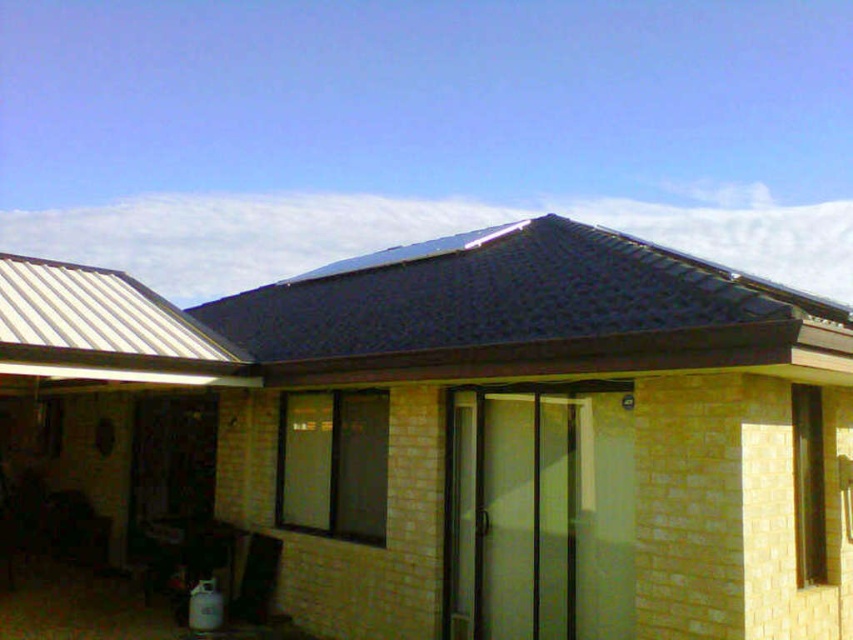
Question: Which of the following is the farthest from the observer?

Choices:
 (A) (677, 337)
 (B) (546, 314)

Answer: (B)

Question: Does yellow brick shed at center have a larger size compared to black tile roof at upper center?

Choices:
 (A) yes
 (B) no

Answer: (A)

Question: Does yellow brick shed at center appear under black tile roof at upper center?

Choices:
 (A) no
 (B) yes

Answer: (B)

Question: Among these points, which one is nearest to the camera?

Choices:
 (A) (619, 252)
 (B) (625, 332)

Answer: (B)

Question: Can you confirm if yellow brick shed at center is positioned above black tile roof at upper center?

Choices:
 (A) no
 (B) yes

Answer: (A)